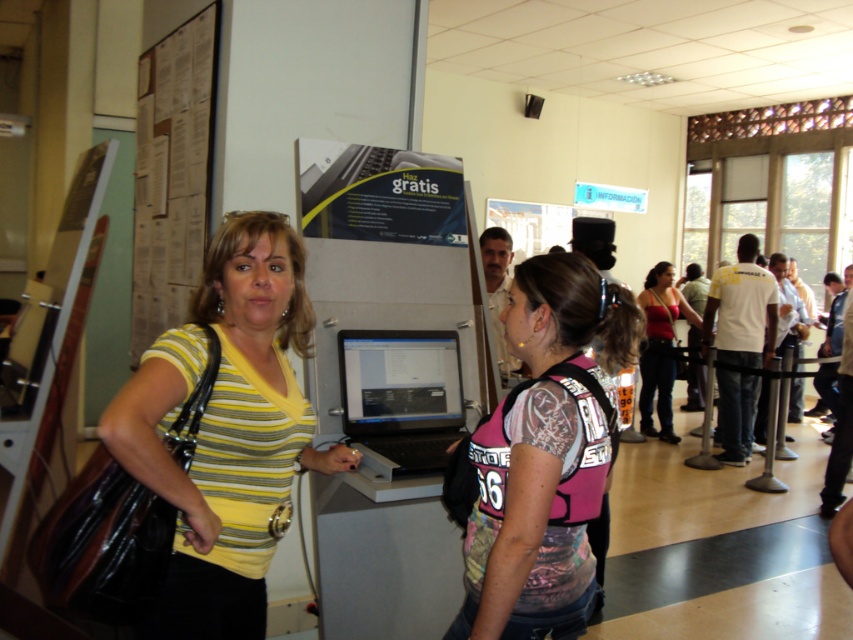
Who is shorter, cardboard posters at upper left or matte black laptop at center?

Standing shorter between the two is matte black laptop at center.

Can you confirm if cardboard posters at upper left is bigger than matte black laptop at center?

Correct, cardboard posters at upper left is larger in size than matte black laptop at center.

Which is behind, point (160, 138) or point (442, 392)?

The point (160, 138) is behind.

I want to click on cardboard posters at upper left, so click(x=171, y=173).

Can you confirm if yellow striped shirt at center is positioned to the left of cardboard posters at upper left?

Incorrect, yellow striped shirt at center is not on the left side of cardboard posters at upper left.

Is point (189, 586) farther from camera compared to point (163, 108)?

No, it is in front of (163, 108).

The width and height of the screenshot is (853, 640). What are the coordinates of `yellow striped shirt at center` in the screenshot? It's located at (225, 429).

Can you confirm if cardboard posters at upper left is bigger than matte red tank top at center?

No.

Can you confirm if cardboard posters at upper left is wider than matte red tank top at center?

In fact, cardboard posters at upper left might be narrower than matte red tank top at center.

Where is `cardboard posters at upper left`? cardboard posters at upper left is located at coordinates coord(171,173).

Locate an element on the screen. The width and height of the screenshot is (853, 640). cardboard posters at upper left is located at coordinates (171, 173).